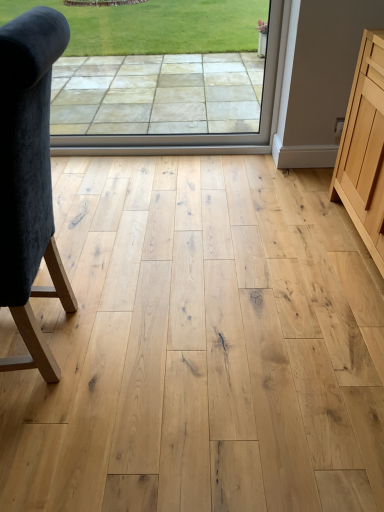
Question: From the image's perspective, does transparent glass window at center appear higher than velvet dark blue chair at left?

Choices:
 (A) yes
 (B) no

Answer: (A)

Question: Is transparent glass window at center smaller than velvet dark blue chair at left?

Choices:
 (A) no
 (B) yes

Answer: (B)

Question: Can you confirm if transparent glass window at center is wider than velvet dark blue chair at left?

Choices:
 (A) no
 (B) yes

Answer: (A)

Question: Is transparent glass window at center bigger than velvet dark blue chair at left?

Choices:
 (A) yes
 (B) no

Answer: (B)

Question: Is transparent glass window at center to the left of velvet dark blue chair at left from the viewer's perspective?

Choices:
 (A) yes
 (B) no

Answer: (B)

Question: From a real-world perspective, is transparent glass window at center located beneath velvet dark blue chair at left?

Choices:
 (A) no
 (B) yes

Answer: (B)

Question: Is natural wood cabinet at right smaller than velvet dark blue chair at left?

Choices:
 (A) yes
 (B) no

Answer: (B)

Question: Does natural wood cabinet at right have a greater height compared to velvet dark blue chair at left?

Choices:
 (A) yes
 (B) no

Answer: (B)

Question: Would you say natural wood cabinet at right is outside velvet dark blue chair at left?

Choices:
 (A) no
 (B) yes

Answer: (B)

Question: From a real-world perspective, is natural wood cabinet at right below velvet dark blue chair at left?

Choices:
 (A) no
 (B) yes

Answer: (B)

Question: Is natural wood cabinet at right shorter than velvet dark blue chair at left?

Choices:
 (A) yes
 (B) no

Answer: (A)

Question: Is natural wood cabinet at right facing towards velvet dark blue chair at left?

Choices:
 (A) yes
 (B) no

Answer: (A)

Question: Is transparent glass window at center smaller than natural wood cabinet at right?

Choices:
 (A) no
 (B) yes

Answer: (B)